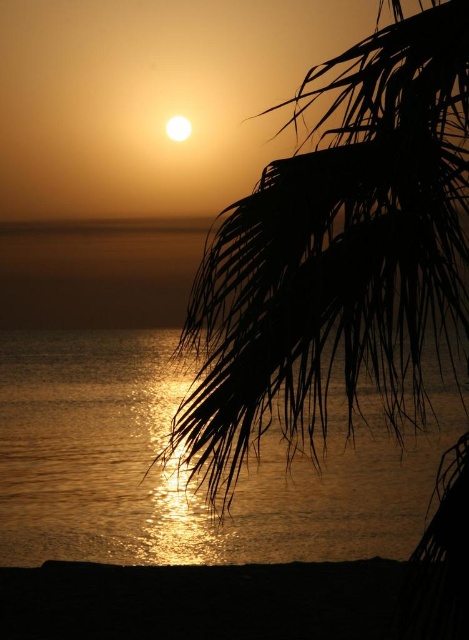
Question: Does silhouette leafy branch at upper right have a larger size compared to glistening water at center?

Choices:
 (A) no
 (B) yes

Answer: (B)

Question: Can you confirm if silhouette leafy branch at upper right is bigger than glistening water at center?

Choices:
 (A) yes
 (B) no

Answer: (A)

Question: Which object is closer to the camera taking this photo?

Choices:
 (A) glistening water at center
 (B) silhouette leafy branch at upper right

Answer: (B)

Question: Does silhouette leafy branch at upper right come in front of glistening water at center?

Choices:
 (A) yes
 (B) no

Answer: (A)